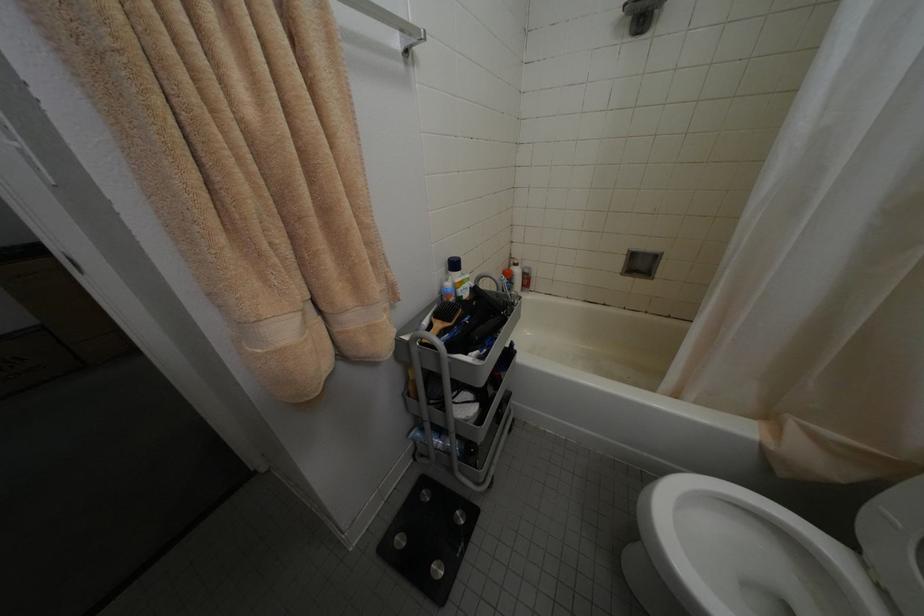
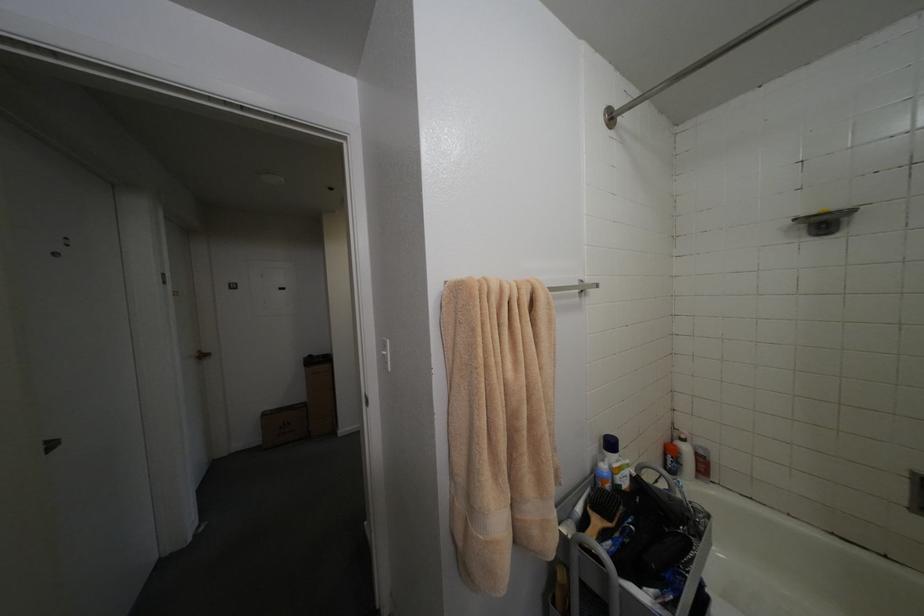
Looking at this image, based on the continuous images, in which direction is the camera rotating?

The camera's rotation is toward left-up.